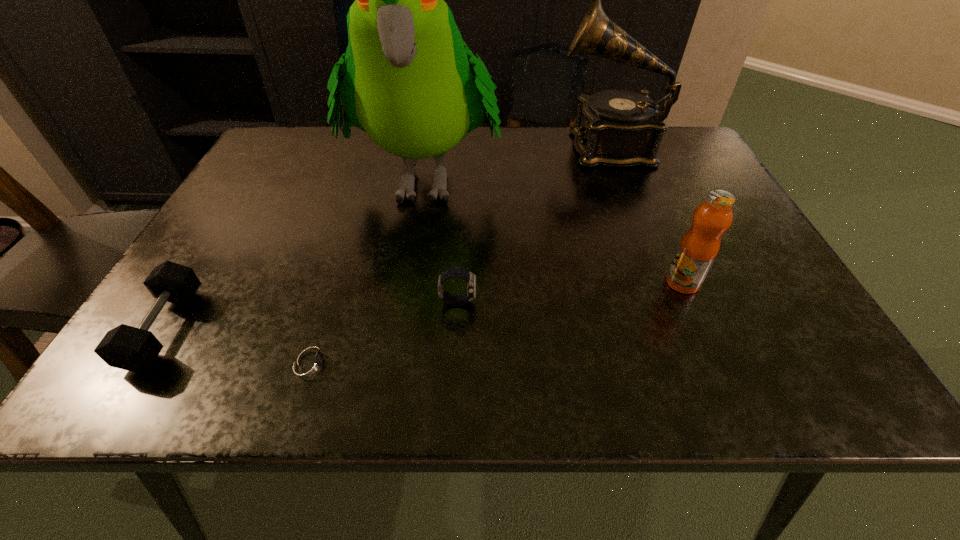
The image size is (960, 540). I want to click on object at the left edge, so click(x=125, y=347).

This screenshot has height=540, width=960. In order to click on phonograph record located in the right edge section of the desktop in this screenshot , I will do `click(617, 128)`.

At what (x,y) coordinates should I click in order to perform the action: click on fruit juice located at the right edge. Please return your answer as a coordinate pair (x, y). The width and height of the screenshot is (960, 540). Looking at the image, I should click on (699, 246).

The width and height of the screenshot is (960, 540). I want to click on object situated at the near left corner, so click(125, 347).

Where is `object situated at the far right corner`? The image size is (960, 540). object situated at the far right corner is located at coordinates 617,128.

This screenshot has height=540, width=960. In the image, there is a desktop. What are the coordinates of `free space at the far edge` in the screenshot? It's located at (350, 154).

Identify the location of blank area at the near edge. The width and height of the screenshot is (960, 540). (655, 396).

This screenshot has width=960, height=540. In order to click on free space at the left edge of the desktop in this screenshot , I will do `click(241, 223)`.

At what (x,y) coordinates should I click in order to perform the action: click on vacant space at the right edge. Please return your answer as a coordinate pair (x, y). The width and height of the screenshot is (960, 540). Looking at the image, I should click on (747, 224).

In the image, there is a desktop. Where is `free space at the far left corner`? free space at the far left corner is located at coordinates (314, 127).